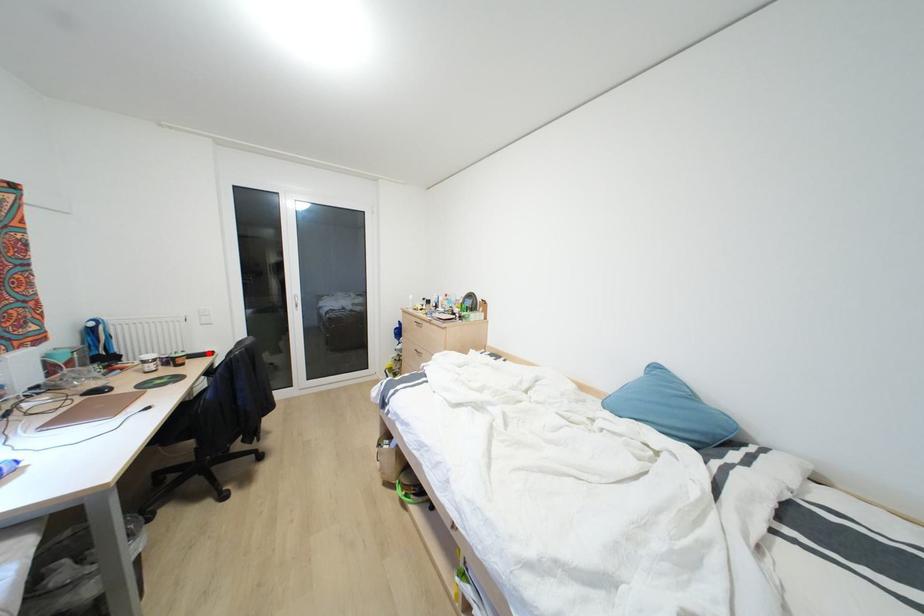
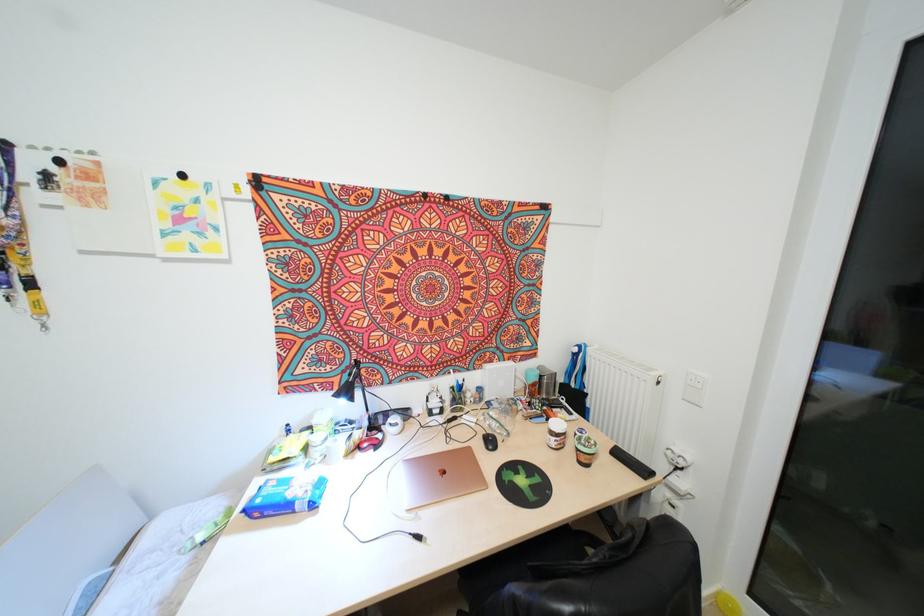
Find the pixel in the second image that matches the highlighted location in the first image.

(642, 471)